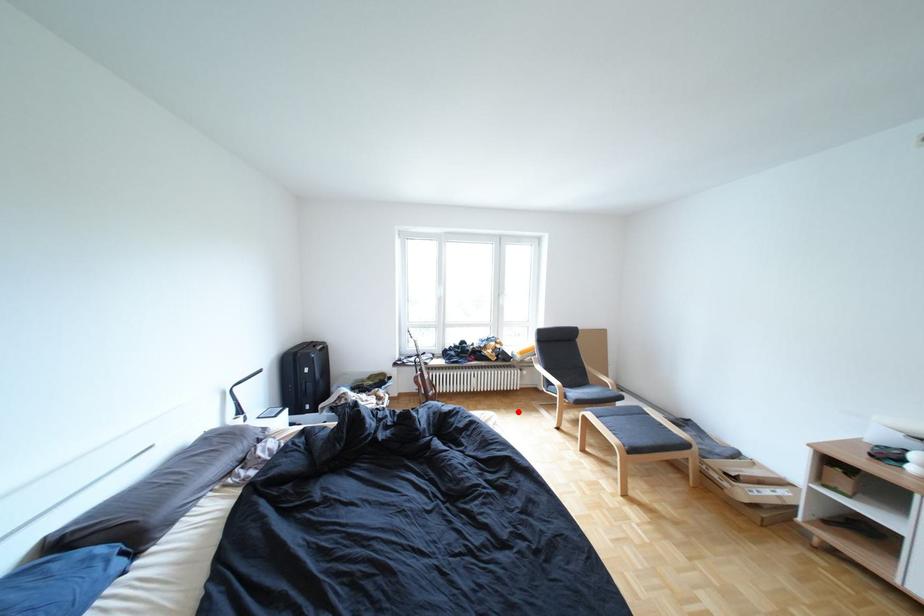
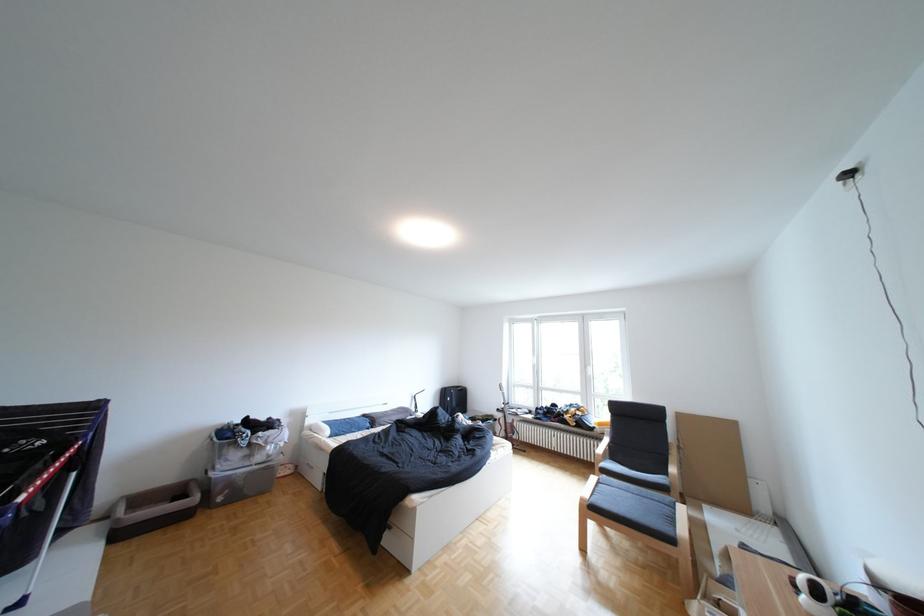
Question: I am providing you with two images of the same scene from different viewpoints. Image1 has a red point marked. In image2, the corresponding 3D location appears at what relative position? Reply with the corresponding letter.

Choices:
 (A) Closer
 (B) Farther

Answer: (B)